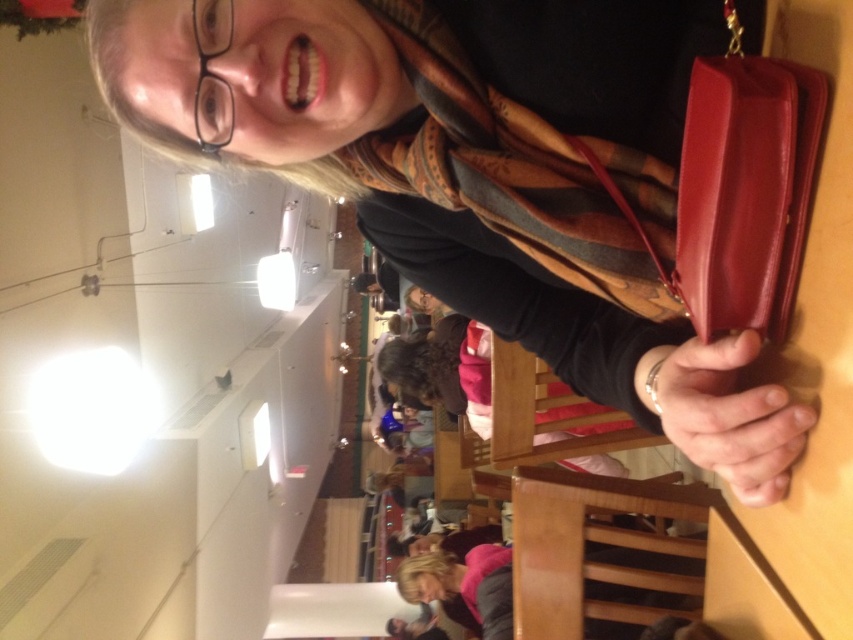
Describe the element at coordinates (500, 168) in the screenshot. I see `plaid wool scarf at upper right` at that location.

Is plaid wool scarf at upper right wider than leather handbag at right?

Yes.

Which is behind, point (512, 122) or point (697, 136)?

Positioned behind is point (512, 122).

The width and height of the screenshot is (853, 640). Identify the location of plaid wool scarf at upper right. (500, 168).